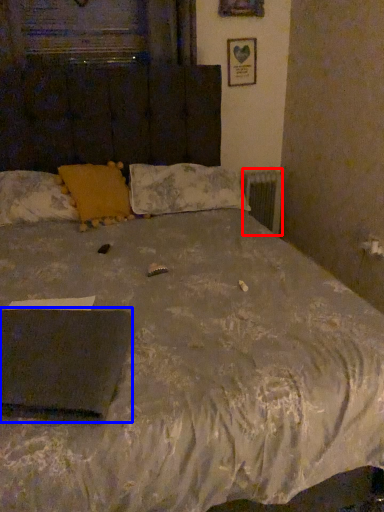
Question: Which of the following is the farthest to the observer, radiator (highlighted by a red box) or pad (highlighted by a blue box)?

Choices:
 (A) radiator
 (B) pad

Answer: (A)